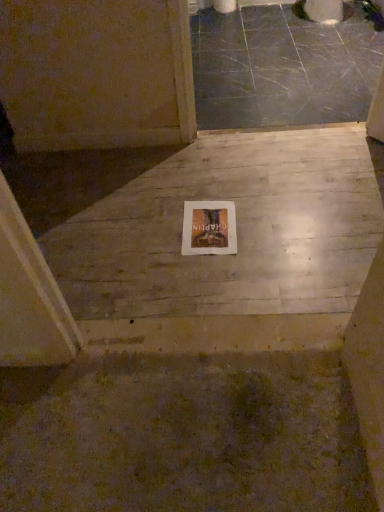
I want to click on free spot in front of wooden book at center, so click(x=216, y=275).